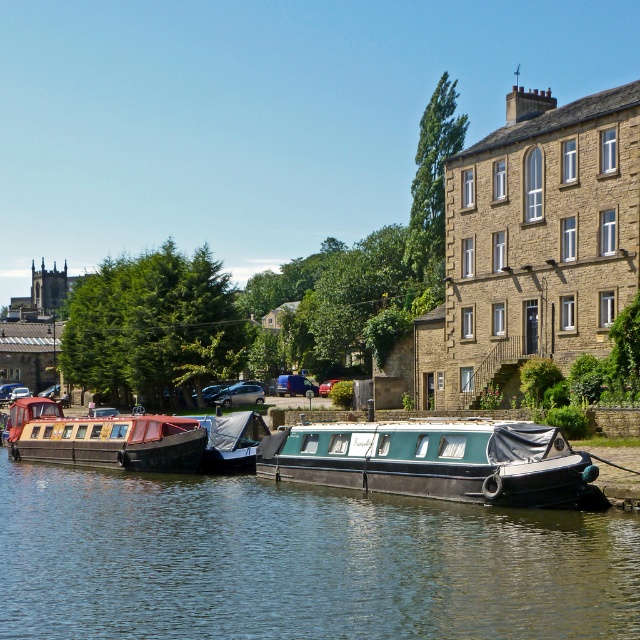
Question: Is wooden polished boat at left above blue tarpaulin boat at center?

Choices:
 (A) yes
 (B) no

Answer: (B)

Question: Which of the following is the closest to the observer?

Choices:
 (A) blue tarpaulin boat at center
 (B) green rubber boat at center

Answer: (B)

Question: Can you confirm if teal matte boat at center is smaller than wooden polished boat at left?

Choices:
 (A) no
 (B) yes

Answer: (B)

Question: Which of these objects is positioned farthest from the green rubber boat at center?

Choices:
 (A) blue tarpaulin boat at center
 (B) teal matte boat at center
 (C) wooden polished boat at left

Answer: (C)

Question: Is wooden polished boat at left to the left of blue tarpaulin boat at center from the viewer's perspective?

Choices:
 (A) yes
 (B) no

Answer: (A)

Question: Which point appears farthest from the camera in this image?

Choices:
 (A) (220, 472)
 (B) (26, 440)
 (C) (516, 436)

Answer: (B)